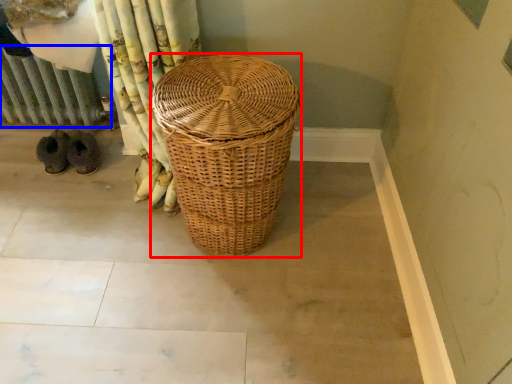
Question: Which of the following is the closest to the observer, picnic basket (highlighted by a red box) or radiator (highlighted by a blue box)?

Choices:
 (A) picnic basket
 (B) radiator

Answer: (A)